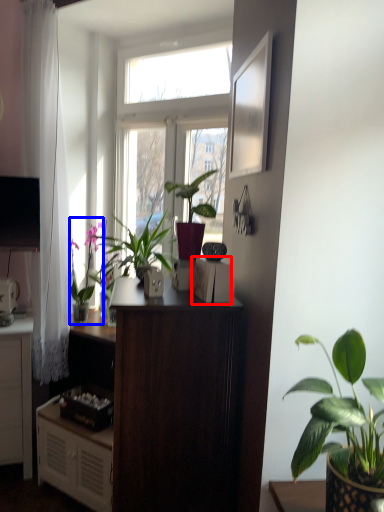
Question: Which of the following is the closest to the observer, appliance (highlighted by a red box) or houseplant (highlighted by a blue box)?

Choices:
 (A) appliance
 (B) houseplant

Answer: (A)